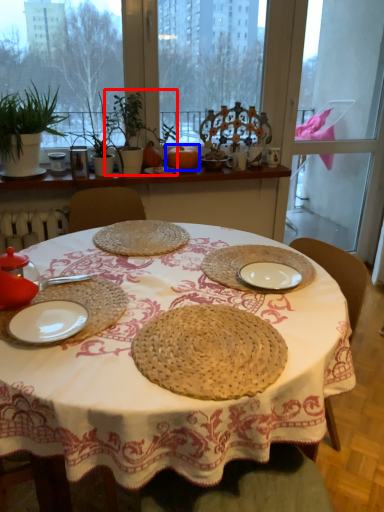
Question: Which object appears farthest to the camera in this image, plant (highlighted by a red box) or fruit (highlighted by a blue box)?

Choices:
 (A) plant
 (B) fruit

Answer: (B)